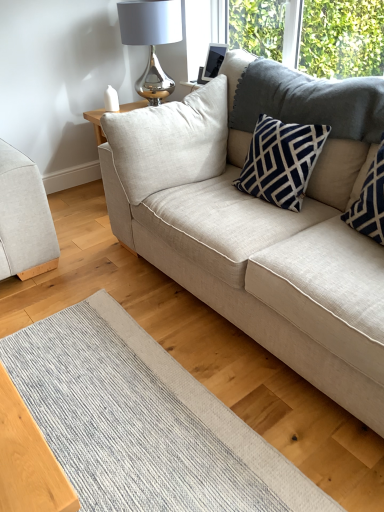
Question: Considering the positions of beige fabric couch at center, which is the 1th studio couch from right to left, and navy blue textured pillow at upper right, placed as the 1th pillow when sorted from right to left, in the image, is beige fabric couch at center, which is the 1th studio couch from right to left, taller or shorter than navy blue textured pillow at upper right, placed as the 1th pillow when sorted from right to left,?

Choices:
 (A) tall
 (B) short

Answer: (A)

Question: Looking at the image, does beige fabric couch at center, which is the 1th studio couch from right to left, seem bigger or smaller compared to navy blue textured pillow at upper right, placed as the 1th pillow when sorted from right to left?

Choices:
 (A) small
 (B) big

Answer: (B)

Question: Considering the real-world distances, which object is closest to the navy blue textured pillow at upper right, placed as the 1th pillow when sorted from right to left?

Choices:
 (A) beige fabric couch at left, which is counted as the first studio couch, starting from the left
 (B) beige fabric couch at center, acting as the 2th studio couch starting from the left
 (C) navy blue textured pillow at upper right, marked as the second pillow in a right-to-left arrangement
 (D) satin silver lamp at upper center
 (E) textured gray mat at lower center

Answer: (C)

Question: Considering the real-world distances, which object is closest to the navy blue textured pillow at upper right, the first pillow when ordered from left to right?

Choices:
 (A) beige fabric couch at center, acting as the 2th studio couch starting from the left
 (B) textured gray mat at lower center
 (C) navy blue textured pillow at upper right, positioned as the second pillow in left-to-right order
 (D) satin silver lamp at upper center
 (E) beige fabric couch at left, which is counted as the first studio couch, starting from the left

Answer: (A)